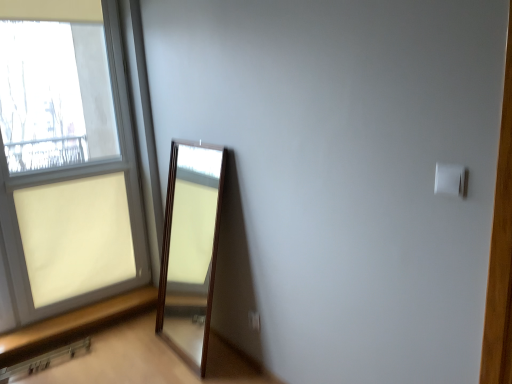
Question: Is the depth of brown wooden window sill at lower left greater than that of matte glass window at left?

Choices:
 (A) yes
 (B) no

Answer: (A)

Question: Considering the relative sizes of brown wooden window sill at lower left and matte glass window at left in the image provided, is brown wooden window sill at lower left wider than matte glass window at left?

Choices:
 (A) yes
 (B) no

Answer: (B)

Question: From the image's perspective, is brown wooden window sill at lower left under matte glass window at left?

Choices:
 (A) no
 (B) yes

Answer: (B)

Question: Does brown wooden window sill at lower left have a greater height compared to matte glass window at left?

Choices:
 (A) no
 (B) yes

Answer: (A)

Question: From a real-world perspective, is brown wooden window sill at lower left on top of matte glass window at left?

Choices:
 (A) yes
 (B) no

Answer: (B)

Question: From a real-world perspective, is white plastic electric outlet at lower center above or below brown wooden window sill at lower left?

Choices:
 (A) above
 (B) below

Answer: (A)

Question: Which is correct: white plastic electric outlet at lower center is inside brown wooden window sill at lower left, or outside of it?

Choices:
 (A) outside
 (B) inside

Answer: (A)

Question: Is point (247, 317) positioned closer to the camera than point (155, 294)?

Choices:
 (A) closer
 (B) farther

Answer: (A)

Question: From the image's perspective, is white plastic electric outlet at lower center located above or below brown wooden window sill at lower left?

Choices:
 (A) below
 (B) above

Answer: (B)

Question: From the image's perspective, is brown wooden window sill at lower left above or below white plastic electric outlet at lower center?

Choices:
 (A) above
 (B) below

Answer: (B)

Question: Choose the correct answer: Is brown wooden window sill at lower left inside white plastic electric outlet at lower center or outside it?

Choices:
 (A) inside
 (B) outside

Answer: (B)

Question: Is brown wooden window sill at lower left wider or thinner than white plastic electric outlet at lower center?

Choices:
 (A) wide
 (B) thin

Answer: (B)

Question: In the image, is brown wooden window sill at lower left positioned in front of or behind white plastic electric outlet at lower center?

Choices:
 (A) front
 (B) behind

Answer: (B)

Question: Considering the positions of white plastic light switch at upper right and brown wooden window sill at lower left in the image, is white plastic light switch at upper right wider or thinner than brown wooden window sill at lower left?

Choices:
 (A) thin
 (B) wide

Answer: (A)

Question: Is point (455, 195) positioned closer to the camera than point (86, 326)?

Choices:
 (A) farther
 (B) closer

Answer: (B)